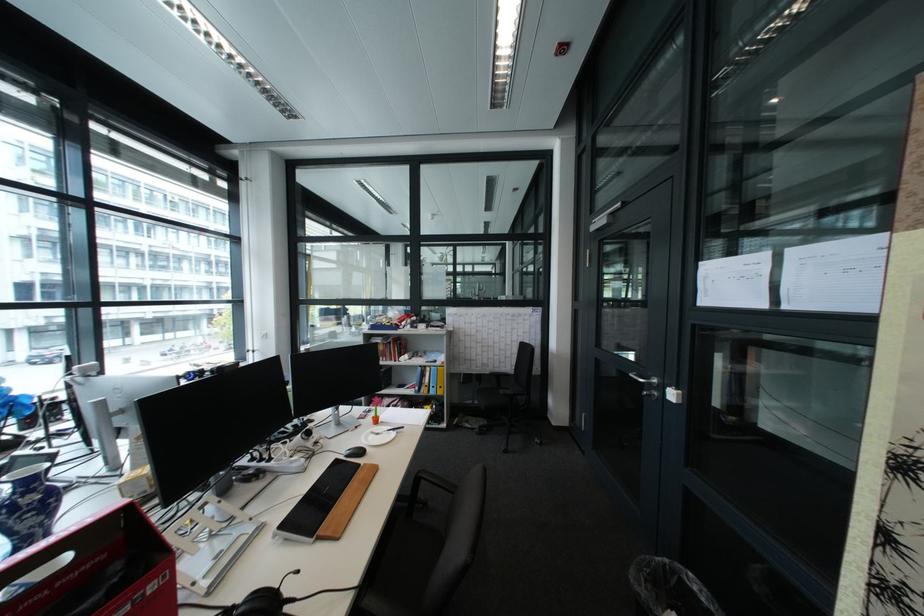
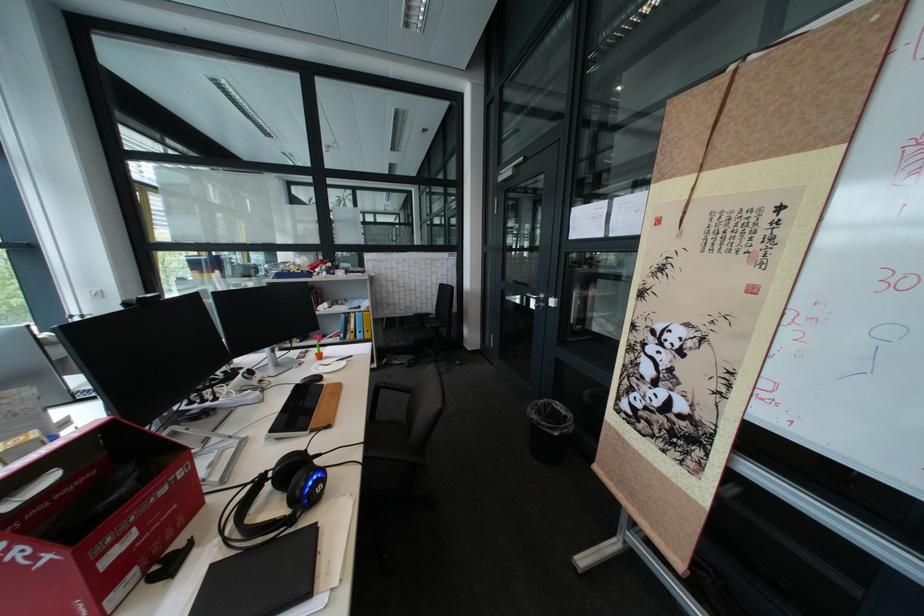
The point at (466, 495) is marked in the first image. Where is the corresponding point in the second image?

(423, 392)